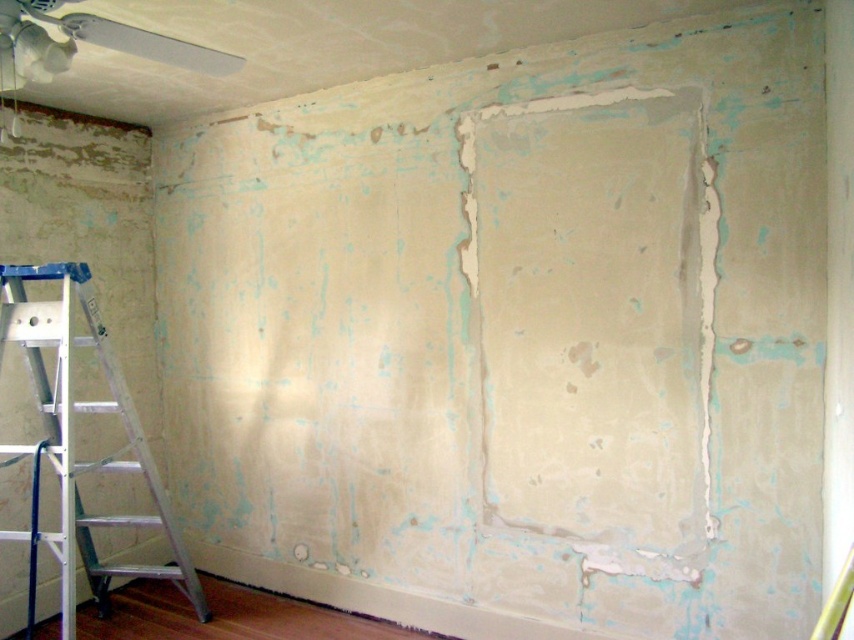
Which of these two, silver/aluminum ladder at left or white plastic fan at upper left, stands taller?

Standing taller between the two is silver/aluminum ladder at left.

Between point (162, 573) and point (205, 65), which one is positioned in front?

Point (205, 65) is more forward.

This screenshot has height=640, width=854. Find the location of `silver/aluminum ladder at left`. silver/aluminum ladder at left is located at coordinates (x=72, y=435).